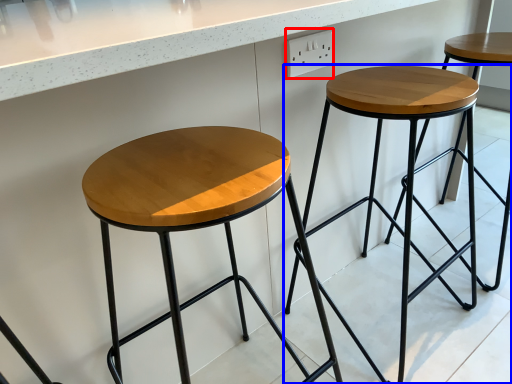
Question: Which object is closer to the camera taking this photo, electric outlet (highlighted by a red box) or stool (highlighted by a blue box)?

Choices:
 (A) electric outlet
 (B) stool

Answer: (B)